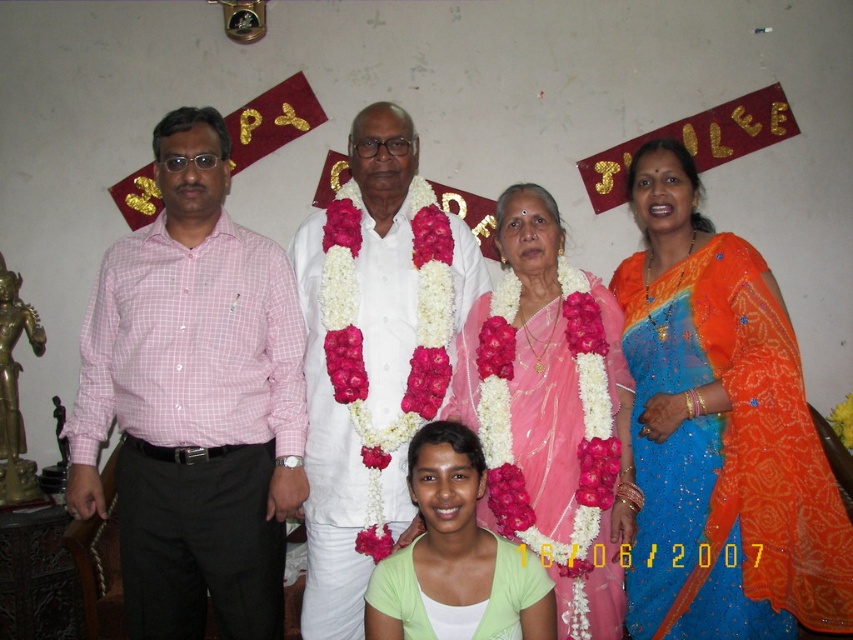
Question: Does pink checkered shirt at left appear on the left side of pink silk saree at center?

Choices:
 (A) no
 (B) yes

Answer: (B)

Question: Among these objects, which one is farthest from the camera?

Choices:
 (A) pink silk saree at center
 (B) pink checkered shirt at left

Answer: (B)

Question: Which point appears farthest from the camera in this image?

Choices:
 (A) pos(103,412)
 (B) pos(398,269)

Answer: (B)

Question: Which object is positioned closest to the orange sequined saree at right?

Choices:
 (A) pink silk saree at center
 (B) pink checkered shirt at left
 (C) light green fabric at center

Answer: (A)

Question: Does orange sequined saree at right come in front of light green fabric at center?

Choices:
 (A) no
 (B) yes

Answer: (B)

Question: Can you confirm if pink silk saree at center is wider than white clothed man at center?

Choices:
 (A) yes
 (B) no

Answer: (B)